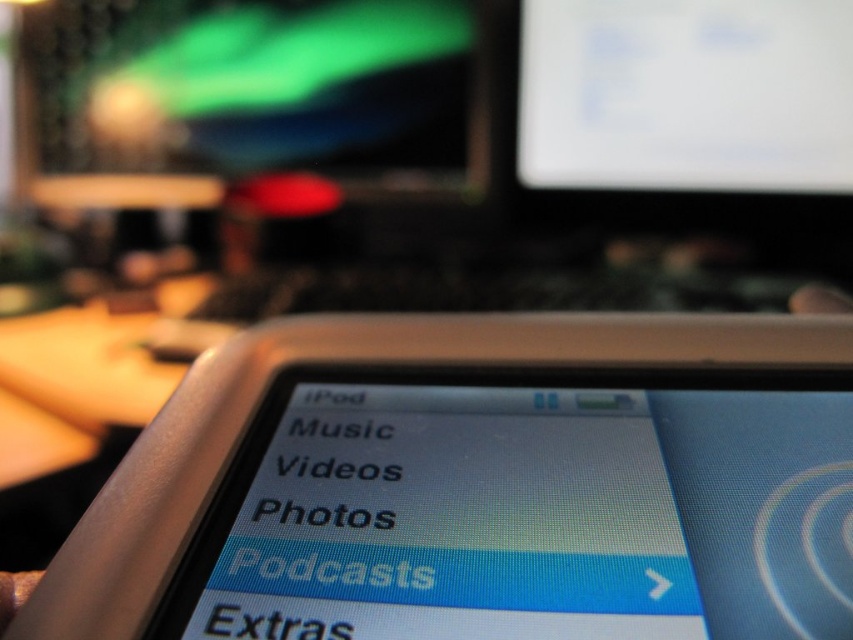
Question: Which point appears farthest from the camera in this image?

Choices:
 (A) (138, 88)
 (B) (675, 24)

Answer: (A)

Question: Which object appears closest to the camera in this image?

Choices:
 (A) white glossy monitor at upper center
 (B) green matte monitor at upper left

Answer: (A)

Question: Is green matte monitor at upper left bigger than white glossy monitor at upper center?

Choices:
 (A) yes
 (B) no

Answer: (A)

Question: Is green matte monitor at upper left positioned in front of white glossy monitor at upper center?

Choices:
 (A) yes
 (B) no

Answer: (B)

Question: Is green matte monitor at upper left thinner than white glossy monitor at upper center?

Choices:
 (A) yes
 (B) no

Answer: (B)